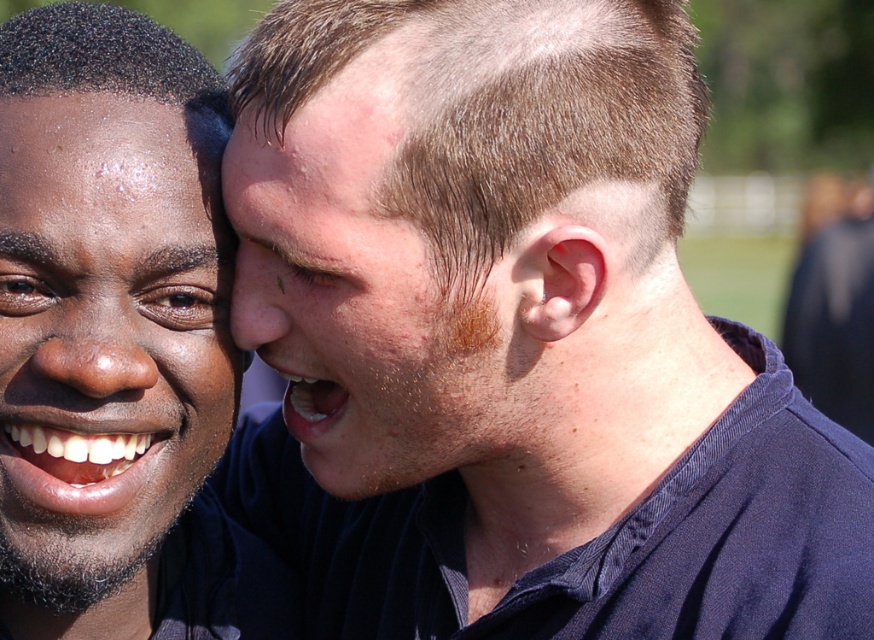
Does matte black face at left have a lesser width compared to dry skin at center?

Yes.

Is point (105, 468) farther from viewer compared to point (237, 332)?

No, it is not.

Where is `matte black face at left`? The height and width of the screenshot is (640, 874). matte black face at left is located at coordinates (106, 337).